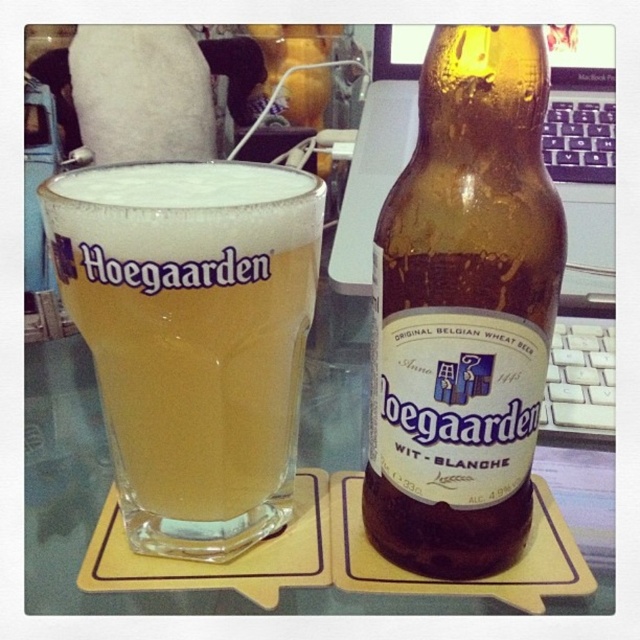
Measure the distance between brown glass bottle at center and camera.

brown glass bottle at center is 9.93 inches away from camera.

Is point (452, 413) more distant than point (84, 273)?

Yes.

At what (x,y) coordinates should I click in order to perform the action: click on brown glass bottle at center. Please return your answer as a coordinate pair (x, y). Image resolution: width=640 pixels, height=640 pixels. Looking at the image, I should click on (465, 308).